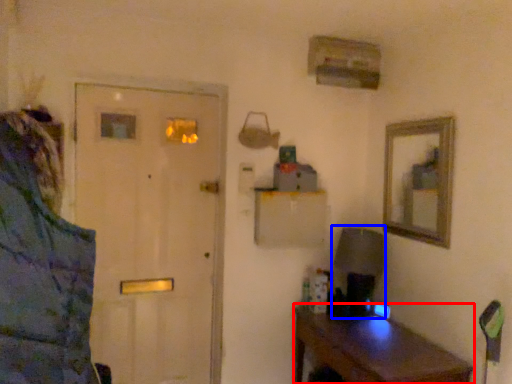
Question: Which object appears farthest to the camera in this image, desk (highlighted by a red box) or table lamp (highlighted by a blue box)?

Choices:
 (A) desk
 (B) table lamp

Answer: (B)